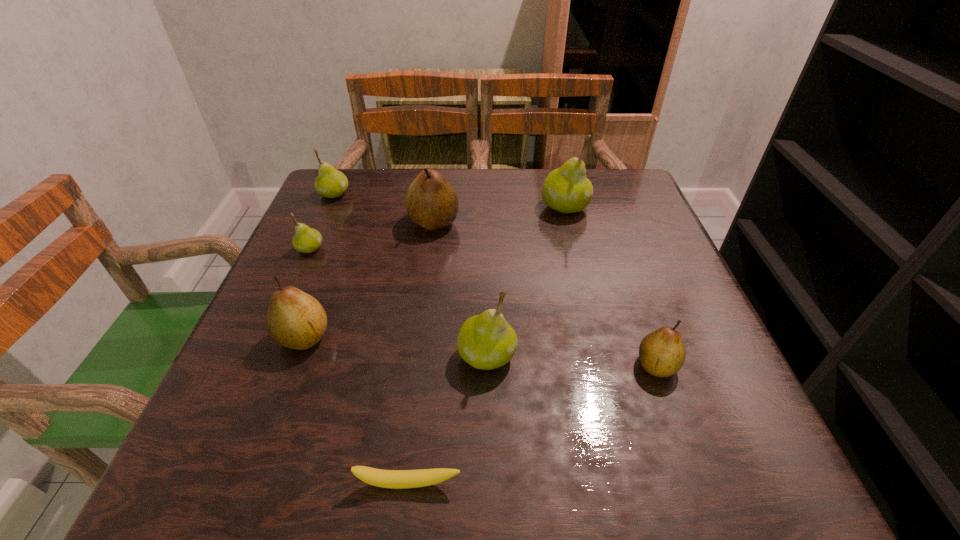
Choose which object is the fifth nearest neighbor to the rightmost green pear. Please provide its 2D coordinates. Your answer should be formatted as a tuple, i.e. [(x, y)], where the tuple contains the x and y coordinates of a point satisfying the conditions above.

[(306, 240)]

Identify which pear is the fifth nearest to the fourth nearest pear. Please provide its 2D coordinates. Your answer should be formatted as a tuple, i.e. [(x, y)], where the tuple contains the x and y coordinates of a point satisfying the conditions above.

[(567, 189)]

What are the coordinates of `the closest pear relative to the second smallest brown pear` in the screenshot? It's located at (306, 240).

Identify the location of green pear that is the fourth closest to the nearest object. This screenshot has width=960, height=540. (331, 183).

Identify the location of green pear object that ranks as the third closest to the banana. This screenshot has height=540, width=960. (567, 189).

Where is `brown pear that stands as the closest to the leftmost brown pear`? This screenshot has height=540, width=960. brown pear that stands as the closest to the leftmost brown pear is located at coordinates (431, 202).

Where is `brown pear that is the closest to the nearest object`? The width and height of the screenshot is (960, 540). brown pear that is the closest to the nearest object is located at coordinates (295, 320).

Image resolution: width=960 pixels, height=540 pixels. In order to click on vacant space that satisfies the following two spatial constraints: 1. on the front side of the rightmost brown pear; 2. on the right side of the smallest green pear in this screenshot , I will do pyautogui.click(x=259, y=365).